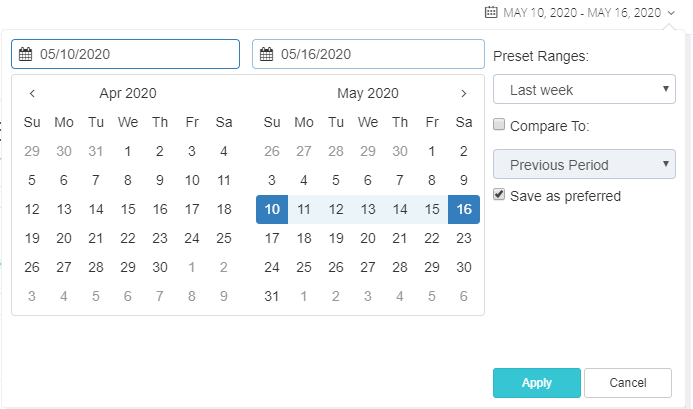
Identify the location of date indicated on calendar. The image size is (693, 409). (356, 204).